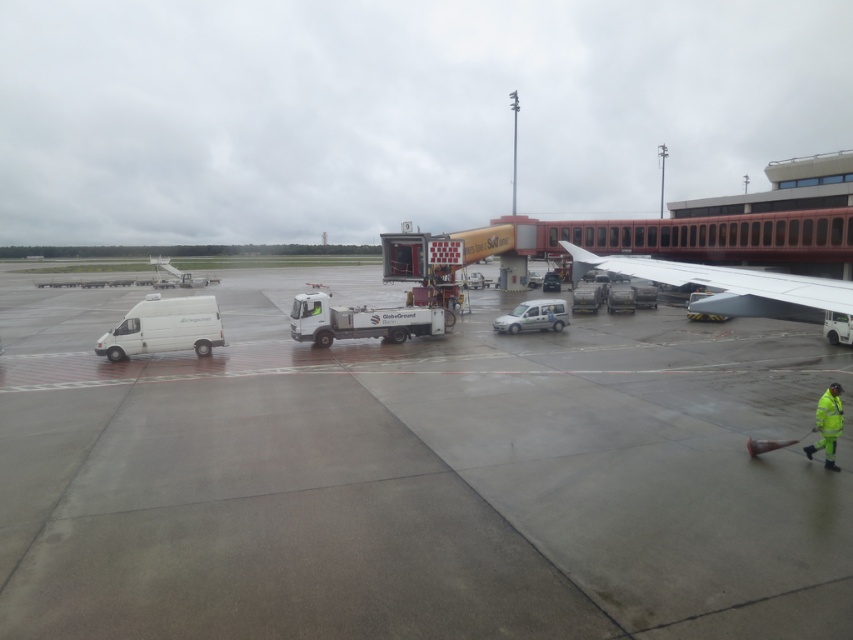
Question: Which of the following is the closest to the observer?

Choices:
 (A) gray concrete tarmac at center
 (B) high visibility yellow jacket at lower right

Answer: (A)

Question: Which of these objects is positioned farthest from the high visibility yellow jacket at lower right?

Choices:
 (A) white matte wing at upper right
 (B) gray concrete tarmac at center

Answer: (B)

Question: Which point is farther from the camera taking this photo?

Choices:
 (A) (833, 388)
 (B) (9, 576)
 (C) (625, 262)

Answer: (C)

Question: Is gray concrete tarmac at center to the right of high visibility yellow jacket at lower right from the viewer's perspective?

Choices:
 (A) no
 (B) yes

Answer: (A)

Question: Is gray concrete tarmac at center to the right of high visibility yellow jacket at lower right from the viewer's perspective?

Choices:
 (A) no
 (B) yes

Answer: (A)

Question: Does white matte wing at upper right have a larger size compared to high visibility yellow jacket at lower right?

Choices:
 (A) yes
 (B) no

Answer: (A)